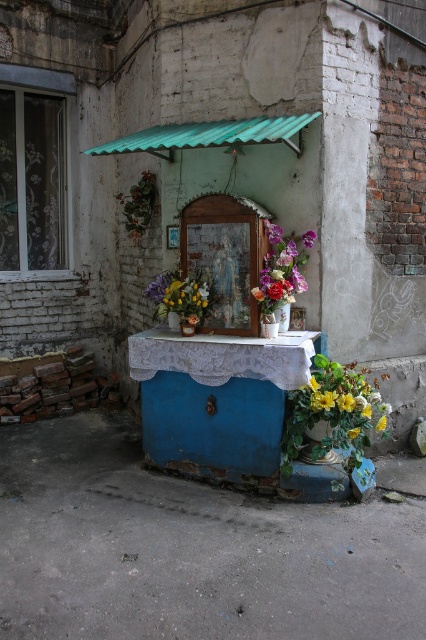
You are standing in front of the shrine and want to place a new decoration exactly at the center of the green corrugated metal awning at upper center. According to the coordinates provided, what are the exact coordinates where you should place the decoration?

The exact coordinates to place the decoration at the center of the green corrugated metal awning at upper center are point (207, 132).

You are a florist who needs to arrange flowers for a customer. The customer wants to know which flower is larger between the vibrant floral bouquet at center and the yellow matte flower at lower right. Can you help them?

The vibrant floral bouquet at center is bigger than the yellow matte flower at lower right, so the vibrant floral bouquet at center is the larger one.